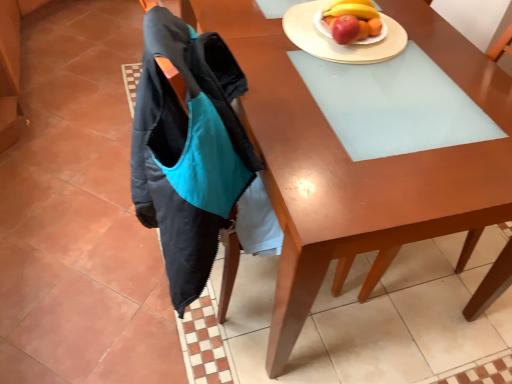
Question: Is wooden desk at center to the right of white glossy plate at upper right, arranged as the second plate when viewed from the left, from the viewer's perspective?

Choices:
 (A) no
 (B) yes

Answer: (A)

Question: From the image's perspective, is wooden desk at center located beneath white glossy plate at upper right, which is counted as the first plate, starting from the right?

Choices:
 (A) yes
 (B) no

Answer: (A)

Question: Is wooden desk at center completely or partially outside of white glossy plate at upper right, which is counted as the first plate, starting from the right?

Choices:
 (A) no
 (B) yes

Answer: (B)

Question: Can you confirm if wooden desk at center is taller than white glossy plate at upper right, arranged as the second plate when viewed from the left?

Choices:
 (A) no
 (B) yes

Answer: (B)

Question: From the image's perspective, is wooden desk at center located above white glossy plate at upper right, arranged as the second plate when viewed from the left?

Choices:
 (A) yes
 (B) no

Answer: (B)

Question: Considering the positions of white glossy plate at upper right, which is counted as the first plate, starting from the right, and wooden plate at upper right, the second plate when ordered from right to left, in the image, is white glossy plate at upper right, which is counted as the first plate, starting from the right, wider or thinner than wooden plate at upper right, the second plate when ordered from right to left,?

Choices:
 (A) thin
 (B) wide

Answer: (A)

Question: Is point (369, 41) positioned closer to the camera than point (312, 41)?

Choices:
 (A) closer
 (B) farther

Answer: (A)

Question: Considering the relative positions of white glossy plate at upper right, which is counted as the first plate, starting from the right, and wooden plate at upper right, the second plate when ordered from right to left, in the image provided, is white glossy plate at upper right, which is counted as the first plate, starting from the right, to the left or to the right of wooden plate at upper right, the second plate when ordered from right to left,?

Choices:
 (A) left
 (B) right

Answer: (B)

Question: From the image's perspective, is white glossy plate at upper right, arranged as the second plate when viewed from the left, positioned above or below wooden plate at upper right, the second plate when ordered from right to left?

Choices:
 (A) above
 (B) below

Answer: (A)

Question: Would you say matte wood chair at upper right is to the left or to the right of wooden desk at center in the picture?

Choices:
 (A) left
 (B) right

Answer: (B)

Question: Does point (458, 223) appear closer or farther from the camera than point (317, 221)?

Choices:
 (A) closer
 (B) farther

Answer: (B)

Question: In the image, is matte wood chair at upper right positioned in front of or behind wooden desk at center?

Choices:
 (A) front
 (B) behind

Answer: (B)

Question: From the image's perspective, is matte wood chair at upper right above or below wooden desk at center?

Choices:
 (A) below
 (B) above

Answer: (A)

Question: Based on their sizes in the image, would you say matte wood chair at upper right is bigger or smaller than white glossy plate at upper right, arranged as the second plate when viewed from the left?

Choices:
 (A) small
 (B) big

Answer: (B)

Question: Is matte wood chair at upper right taller or shorter than white glossy plate at upper right, arranged as the second plate when viewed from the left?

Choices:
 (A) tall
 (B) short

Answer: (A)